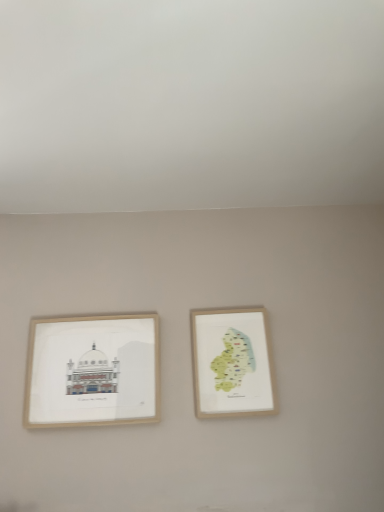
The width and height of the screenshot is (384, 512). I want to click on wooden picture frame at left, arranged as the 2th picture frame when viewed from the right, so click(92, 371).

What do you see at coordinates (92, 371) in the screenshot? I see `wooden picture frame at left, arranged as the 2th picture frame when viewed from the right` at bounding box center [92, 371].

From the picture: What is the approximate width of wooden picture frame at left, arranged as the 2th picture frame when viewed from the right?

The width of wooden picture frame at left, arranged as the 2th picture frame when viewed from the right, is 1.90 inches.

Looking at this image, measure the distance between wooden map at center right, the second picture frame positioned from the left, and camera.

wooden map at center right, the second picture frame positioned from the left, is 1.68 meters from camera.

The width and height of the screenshot is (384, 512). In order to click on wooden map at center right, the second picture frame positioned from the left in this screenshot , I will do `click(232, 362)`.

The width and height of the screenshot is (384, 512). What do you see at coordinates (232, 362) in the screenshot?
I see `wooden map at center right, the 1th picture frame from the right` at bounding box center [232, 362].

The width and height of the screenshot is (384, 512). Identify the location of wooden picture frame at left, arranged as the 2th picture frame when viewed from the right. (92, 371).

Would you say wooden map at center right, the second picture frame positioned from the left, is to the left or to the right of wooden picture frame at left, arranged as the 2th picture frame when viewed from the right, in the picture?

Clearly, wooden map at center right, the second picture frame positioned from the left, is on the right of wooden picture frame at left, arranged as the 2th picture frame when viewed from the right, in the image.

Considering the relative positions of wooden map at center right, the 1th picture frame from the right, and wooden picture frame at left, arranged as the 2th picture frame when viewed from the right, in the image provided, is wooden map at center right, the 1th picture frame from the right, behind wooden picture frame at left, arranged as the 2th picture frame when viewed from the right,?

Yes, wooden map at center right, the 1th picture frame from the right, is further from the camera.

Does point (233, 371) lie in front of point (73, 326)?

Yes.

From the image's perspective, which is below, wooden map at center right, the second picture frame positioned from the left, or wooden picture frame at left, arranged as the 2th picture frame when viewed from the right?

wooden picture frame at left, arranged as the 2th picture frame when viewed from the right, appears lower in the image.

From a real-world perspective, which object rests below the other?

wooden picture frame at left, arranged as the 2th picture frame when viewed from the right.

Does wooden map at center right, the second picture frame positioned from the left, have a lesser width compared to wooden picture frame at left, arranged as the 2th picture frame when viewed from the right?

Indeed, wooden map at center right, the second picture frame positioned from the left, has a lesser width compared to wooden picture frame at left, arranged as the 2th picture frame when viewed from the right.

Is wooden map at center right, the second picture frame positioned from the left, taller or shorter than wooden picture frame at left, arranged as the 2th picture frame when viewed from the right?

Considering their sizes, wooden map at center right, the second picture frame positioned from the left, has less height than wooden picture frame at left, arranged as the 2th picture frame when viewed from the right.

Considering the relative sizes of wooden map at center right, the second picture frame positioned from the left, and wooden picture frame at left, marked as the first picture frame in a left-to-right arrangement, in the image provided, is wooden map at center right, the second picture frame positioned from the left, smaller than wooden picture frame at left, marked as the first picture frame in a left-to-right arrangement,?

Yes.

Is wooden picture frame at left, arranged as the 2th picture frame when viewed from the right, surrounded by wooden map at center right, the second picture frame positioned from the left?

No, wooden picture frame at left, arranged as the 2th picture frame when viewed from the right, is not inside wooden map at center right, the second picture frame positioned from the left.

Is wooden map at center right, the 1th picture frame from the right, placed right next to wooden picture frame at left, marked as the first picture frame in a left-to-right arrangement?

No, wooden map at center right, the 1th picture frame from the right, is not making contact with wooden picture frame at left, marked as the first picture frame in a left-to-right arrangement.

Could you tell me if wooden map at center right, the second picture frame positioned from the left, is turned towards wooden picture frame at left, marked as the first picture frame in a left-to-right arrangement?

No, wooden map at center right, the second picture frame positioned from the left, is not aimed at wooden picture frame at left, marked as the first picture frame in a left-to-right arrangement.

Where is `picture frame lying on the right of wooden picture frame at left, arranged as the 2th picture frame when viewed from the right`? This screenshot has height=512, width=384. picture frame lying on the right of wooden picture frame at left, arranged as the 2th picture frame when viewed from the right is located at coordinates (232, 362).

Considering the relative positions of wooden picture frame at left, marked as the first picture frame in a left-to-right arrangement, and wooden map at center right, the second picture frame positioned from the left, in the image provided, is wooden picture frame at left, marked as the first picture frame in a left-to-right arrangement, to the left or to the right of wooden map at center right, the second picture frame positioned from the left,?

From the image, it's evident that wooden picture frame at left, marked as the first picture frame in a left-to-right arrangement, is to the left of wooden map at center right, the second picture frame positioned from the left.

Which is in front, wooden picture frame at left, arranged as the 2th picture frame when viewed from the right, or wooden map at center right, the 1th picture frame from the right?

Positioned in front is wooden picture frame at left, arranged as the 2th picture frame when viewed from the right.

Is point (150, 382) positioned behind point (254, 332)?

No, (150, 382) is closer to viewer.

From the image's perspective, would you say wooden picture frame at left, arranged as the 2th picture frame when viewed from the right, is positioned over wooden map at center right, the 1th picture frame from the right?

Actually, wooden picture frame at left, arranged as the 2th picture frame when viewed from the right, appears below wooden map at center right, the 1th picture frame from the right, in the image.

From a real-world perspective, between wooden picture frame at left, marked as the first picture frame in a left-to-right arrangement, and wooden map at center right, the second picture frame positioned from the left, who is vertically higher?

From a 3D spatial view, wooden map at center right, the second picture frame positioned from the left, is above.

Which object is thinner, wooden picture frame at left, arranged as the 2th picture frame when viewed from the right, or wooden map at center right, the second picture frame positioned from the left?

With smaller width is wooden map at center right, the second picture frame positioned from the left.

Which of these two, wooden picture frame at left, marked as the first picture frame in a left-to-right arrangement, or wooden map at center right, the second picture frame positioned from the left, stands taller?

With more height is wooden picture frame at left, marked as the first picture frame in a left-to-right arrangement.

Between wooden picture frame at left, marked as the first picture frame in a left-to-right arrangement, and wooden map at center right, the second picture frame positioned from the left, which one has smaller size?

wooden map at center right, the second picture frame positioned from the left.

Is wooden map at center right, the 1th picture frame from the right, located within wooden picture frame at left, arranged as the 2th picture frame when viewed from the right?

No, wooden map at center right, the 1th picture frame from the right, is located outside of wooden picture frame at left, arranged as the 2th picture frame when viewed from the right.

Are wooden picture frame at left, marked as the first picture frame in a left-to-right arrangement, and wooden map at center right, the 1th picture frame from the right, located far from each other?

Actually, wooden picture frame at left, marked as the first picture frame in a left-to-right arrangement, and wooden map at center right, the 1th picture frame from the right, are a little close together.

Is wooden picture frame at left, arranged as the 2th picture frame when viewed from the right, turned away from wooden map at center right, the 1th picture frame from the right?

wooden picture frame at left, arranged as the 2th picture frame when viewed from the right, is not turned away from wooden map at center right, the 1th picture frame from the right.

Could you measure the distance between wooden picture frame at left, marked as the first picture frame in a left-to-right arrangement, and wooden map at center right, the second picture frame positioned from the left?

wooden picture frame at left, marked as the first picture frame in a left-to-right arrangement, is 36.30 centimeters from wooden map at center right, the second picture frame positioned from the left.

Find the location of a particular element. picture frame that appears below the wooden map at center right, the second picture frame positioned from the left (from the image's perspective) is located at coordinates (92, 371).

Locate an element on the screen. picture frame below the wooden map at center right, the second picture frame positioned from the left (from the image's perspective) is located at coordinates (92, 371).

You are a GUI agent. You are given a task and a screenshot of the screen. Output one action in this format:
    pyautogui.click(x=<x>, y=<y>)
    Task: Click on the picture frame on the left of wooden map at center right, the second picture frame positioned from the left
    
    Given the screenshot: What is the action you would take?
    pyautogui.click(x=92, y=371)